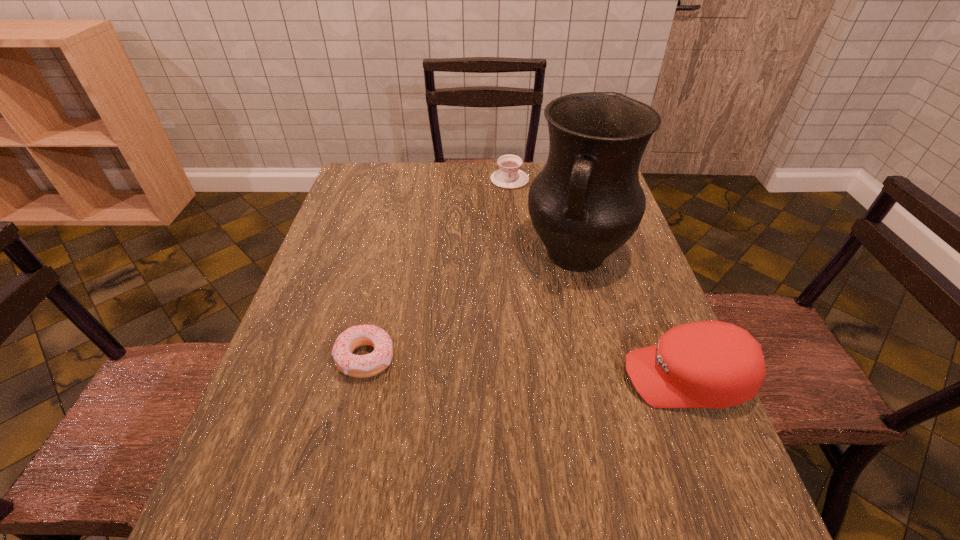
You are a GUI agent. You are given a task and a screenshot of the screen. Output one action in this format:
    pyautogui.click(x=<x>, y=<y>)
    Task: Click on the empty location between the farthest object and the doughnut
    This screenshot has height=540, width=960.
    Given the screenshot: What is the action you would take?
    pyautogui.click(x=438, y=268)

At what (x,y) coordinates should I click in order to perform the action: click on vacant space that's between the tallest object and the cap. Please return your answer as a coordinate pair (x, y). This screenshot has height=540, width=960. Looking at the image, I should click on (631, 316).

What are the coordinates of `unoccupied position between the shortest object and the cap` in the screenshot? It's located at (526, 368).

Identify which object is the nearest to the second shortest object. Please provide its 2D coordinates. Your answer should be formatted as a tuple, i.e. [(x, y)], where the tuple contains the x and y coordinates of a point satisfying the conditions above.

[(587, 202)]

At what (x,y) coordinates should I click in order to perform the action: click on object that is the third nearest to the teacup. Please return your answer as a coordinate pair (x, y). The height and width of the screenshot is (540, 960). Looking at the image, I should click on (707, 364).

I want to click on free space that satisfies the following two spatial constraints: 1. on the front side of the pitcher; 2. on the left side of the third tallest object, so click(x=516, y=255).

You are a GUI agent. You are given a task and a screenshot of the screen. Output one action in this format:
    pyautogui.click(x=<x>, y=<y>)
    Task: Click on the vacant region that satisfies the following two spatial constraints: 1. on the front side of the third shortest object; 2. on the front-facing side of the doughnut
    
    Given the screenshot: What is the action you would take?
    pyautogui.click(x=361, y=378)

You are a GUI agent. You are given a task and a screenshot of the screen. Output one action in this format:
    pyautogui.click(x=<x>, y=<y>)
    Task: Click on the free space in the image that satisfies the following two spatial constraints: 1. on the back side of the shortest object; 2. on the right side of the teacup
    The width and height of the screenshot is (960, 540).
    Given the screenshot: What is the action you would take?
    pyautogui.click(x=407, y=179)